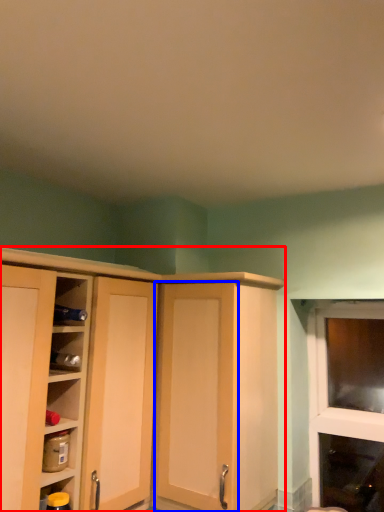
Question: Among these objects, which one is nearest to the camera, cupboard (highlighted by a red box) or screen door (highlighted by a blue box)?

Choices:
 (A) cupboard
 (B) screen door

Answer: (A)